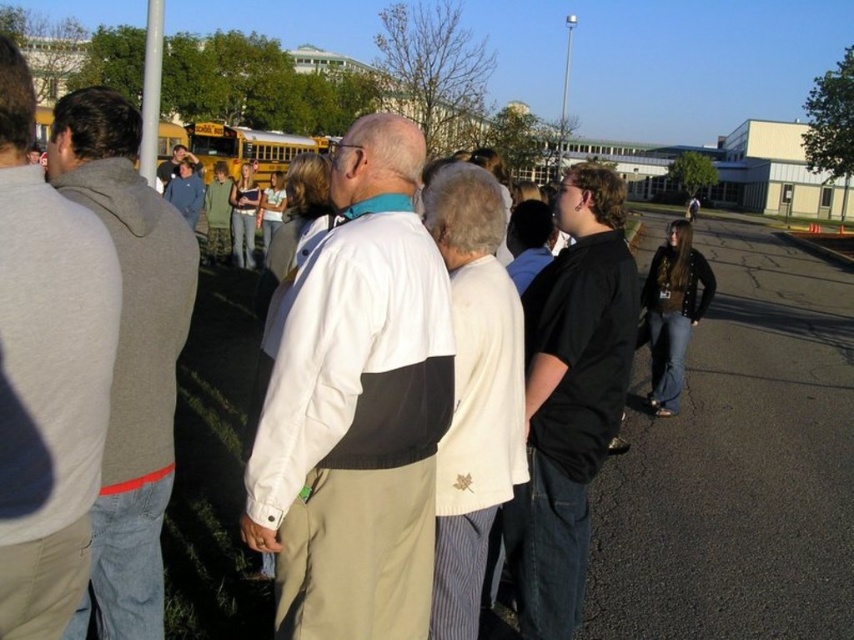
Can you confirm if white matte jacket at center is positioned below light gray sweater at center?

Correct, white matte jacket at center is located below light gray sweater at center.

At what (x,y) coordinates should I click in order to perform the action: click on white matte jacket at center. Please return your answer as a coordinate pair (x, y). This screenshot has width=854, height=640. Looking at the image, I should click on (357, 406).

Which is behind, point (355, 374) or point (41, 316)?

The point (355, 374) is behind.

Locate an element on the screen. white matte jacket at center is located at coordinates (357, 406).

Is light gray sweater at center thinner than gray fleece sweatshirt at left?

Yes.

At what (x,y) coordinates should I click in order to perform the action: click on light gray sweater at center. Please return your answer as a coordinate pair (x, y). The width and height of the screenshot is (854, 640). Looking at the image, I should click on (47, 372).

Does yellow metallic school bus at center have a greater height compared to matte black shirt at center?

Yes, yellow metallic school bus at center is taller than matte black shirt at center.

Between yellow metallic school bus at center and matte black shirt at center, which one has more height?

yellow metallic school bus at center is taller.

Between point (214, 145) and point (182, 147), which one is positioned behind?

The point (214, 145) is behind.

Where is `yellow metallic school bus at center`? The image size is (854, 640). yellow metallic school bus at center is located at coordinates (249, 148).